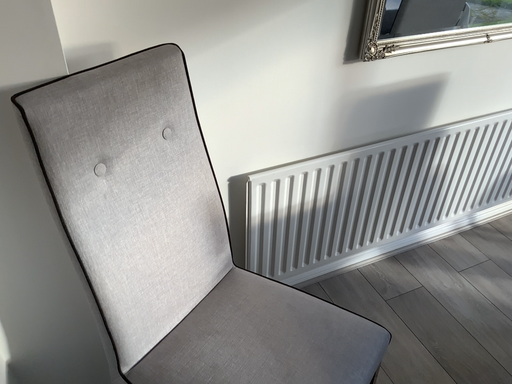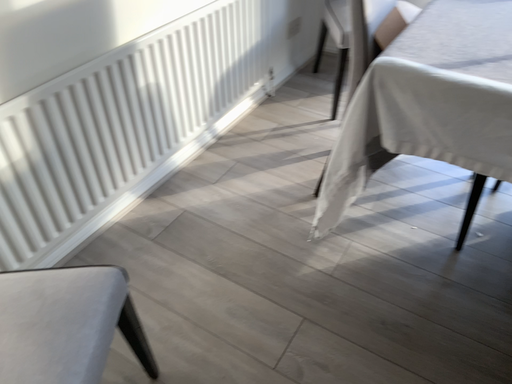
Question: Which way did the camera rotate in the video?

Choices:
 (A) rotated left
 (B) rotated right

Answer: (B)